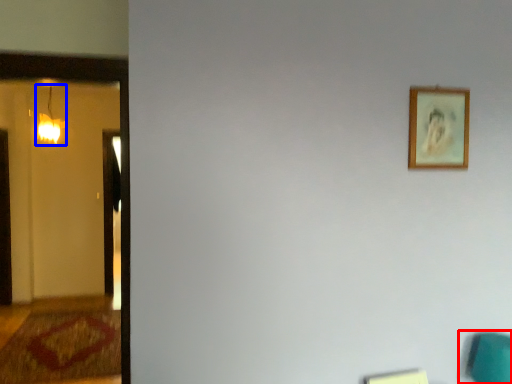
Question: Which of the following is the closest to the observer, swivel chair (highlighted by a red box) or lamp (highlighted by a blue box)?

Choices:
 (A) swivel chair
 (B) lamp

Answer: (A)